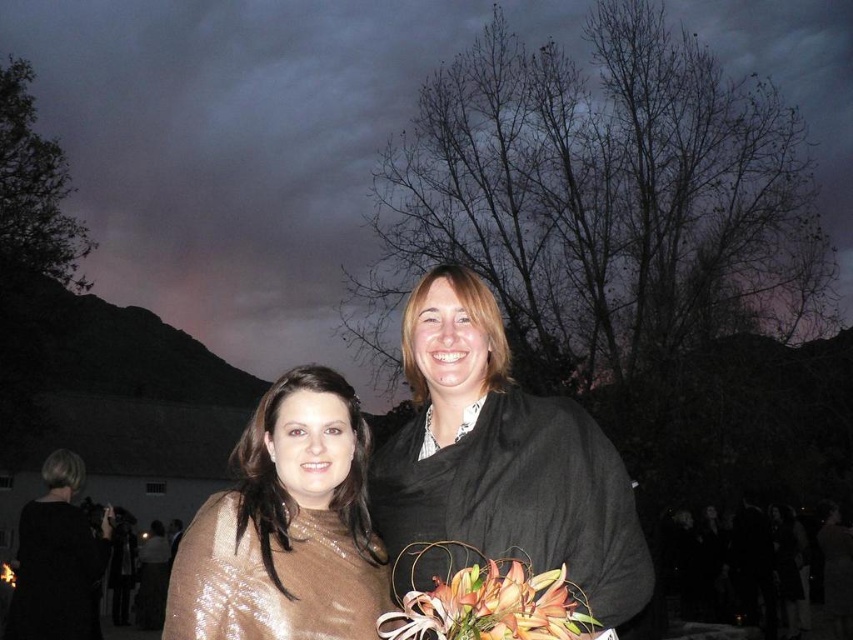
Question: Is orange lily bouquet at center smaller than shiny gold dress at lower left?

Choices:
 (A) yes
 (B) no

Answer: (A)

Question: Is black matte dress at center smaller than shiny gold dress at center?

Choices:
 (A) no
 (B) yes

Answer: (B)

Question: Which object is positioned farthest from the orange lily bouquet at center?

Choices:
 (A) black silk suit at lower left
 (B) shiny gold dress at center

Answer: (A)

Question: Which object is closer to the camera taking this photo?

Choices:
 (A) shiny gold dress at lower left
 (B) black silk suit at lower left

Answer: (A)

Question: Does black matte dress at center appear on the right side of shiny gold dress at lower left?

Choices:
 (A) no
 (B) yes

Answer: (B)

Question: Which point is closer to the camera?

Choices:
 (A) shiny gold dress at lower left
 (B) black silk suit at lower left
 (C) orange lily bouquet at center
 (D) shiny gold dress at center

Answer: (C)